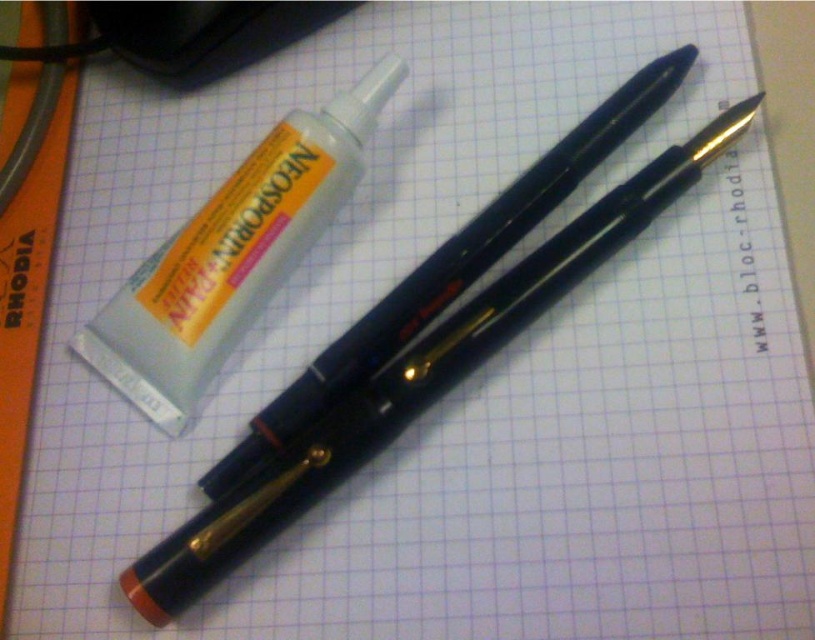
Question: Is white glossy tube at upper left behind black plastic pen at center?

Choices:
 (A) no
 (B) yes

Answer: (B)

Question: Is white glossy tube at upper left behind black plastic pen at center?

Choices:
 (A) no
 (B) yes

Answer: (B)

Question: Which object appears closest to the camera in this image?

Choices:
 (A) black plastic pen at center
 (B) white glossy tube at upper left

Answer: (A)

Question: Which of the following is the farthest from the observer?

Choices:
 (A) (485, 241)
 (B) (197, 337)

Answer: (A)

Question: Among these objects, which one is nearest to the camera?

Choices:
 (A) black plastic pen at center
 (B) white glossy tube at upper left

Answer: (A)

Question: Does white glossy tube at upper left appear under black plastic pen at center?

Choices:
 (A) no
 (B) yes

Answer: (A)